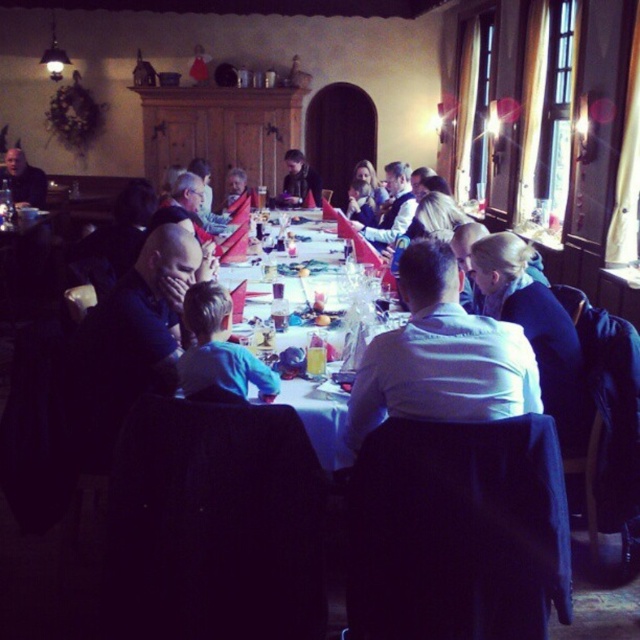
Question: Considering the relative positions of dark blue shirt at left and white glossy table at center in the image provided, where is dark blue shirt at left located with respect to white glossy table at center?

Choices:
 (A) right
 (B) left

Answer: (B)

Question: Which of the following is the farthest from the observer?

Choices:
 (A) (285, 179)
 (B) (516, 257)
 (C) (36, 198)
 (D) (380, 406)

Answer: (A)

Question: Does white shirt at center have a larger size compared to white glossy table at center?

Choices:
 (A) yes
 (B) no

Answer: (B)

Question: Which object is the closest to the blonde hair at upper right?

Choices:
 (A) dark brown leather jacket at center
 (B) white shirt at center
 (C) matte black jacket at left
 (D) blue cotton shirt at center

Answer: (B)

Question: Is blonde hair at upper right further to camera compared to white glossy table at center?

Choices:
 (A) yes
 (B) no

Answer: (B)

Question: Which object is closer to the camera taking this photo?

Choices:
 (A) dark blue shirt at left
 (B) dark brown leather jacket at center

Answer: (A)